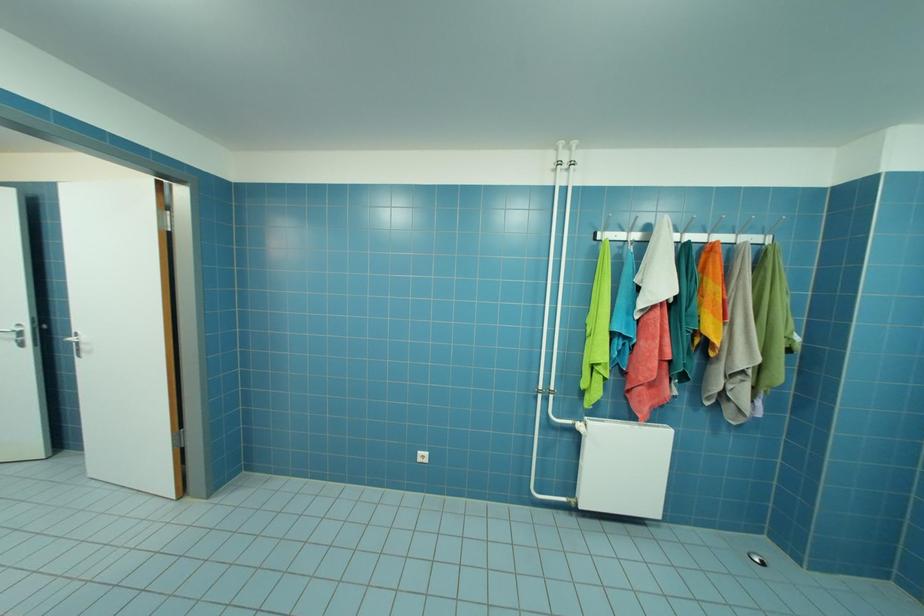
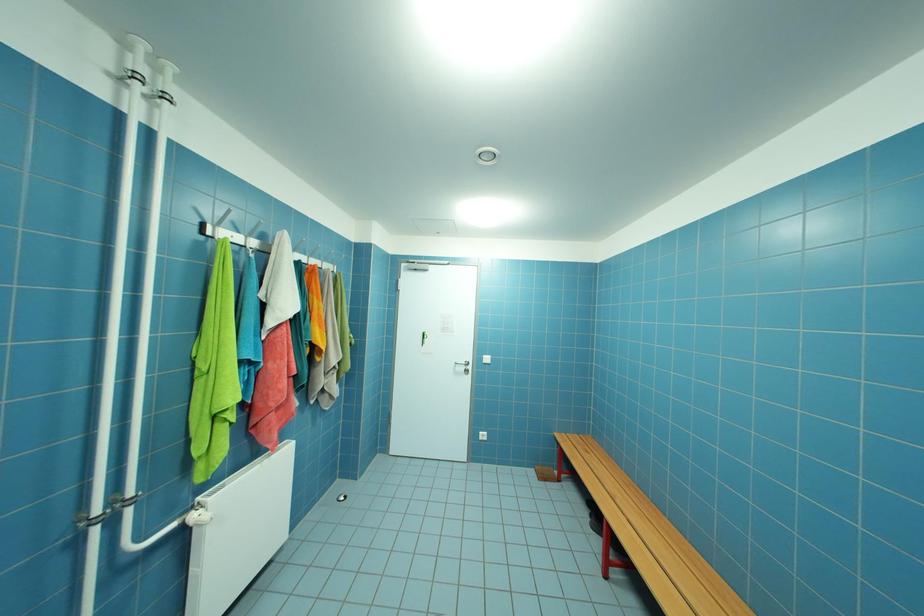
Question: The camera is either moving clockwise (left) or counter-clockwise (right) around the object. The first image is from the beginning of the video and the second image is from the end. Is the camera moving left or right when shooting the video?

Choices:
 (A) Left
 (B) Right

Answer: (A)